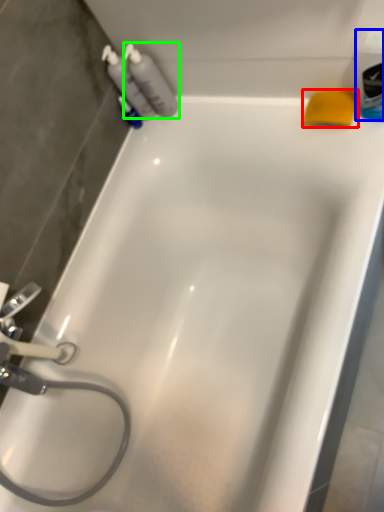
Question: Considering the real-world distances, which object is closest to soap (highlighted by a red box)? mouthwash (highlighted by a blue box) or cleaning product (highlighted by a green box).

Choices:
 (A) mouthwash
 (B) cleaning product

Answer: (A)